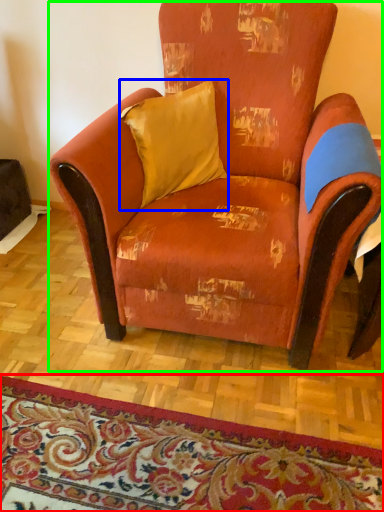
Question: Which object is positioned farthest from mat (highlighted by a red box)? Select from pillow (highlighted by a blue box) and chair (highlighted by a green box).

Choices:
 (A) pillow
 (B) chair

Answer: (A)